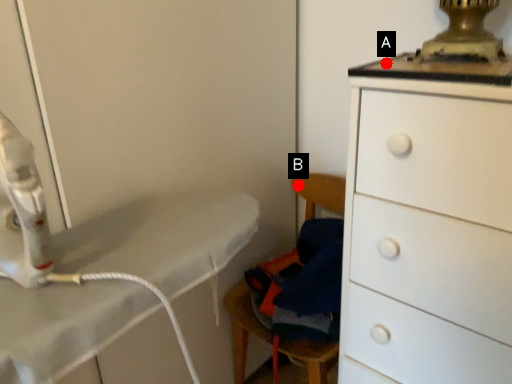
Question: Two points are circled on the image, labeled by A and B beside each circle. Which point appears closest to the camera in this image?

Choices:
 (A) A is closer
 (B) B is closer

Answer: (A)